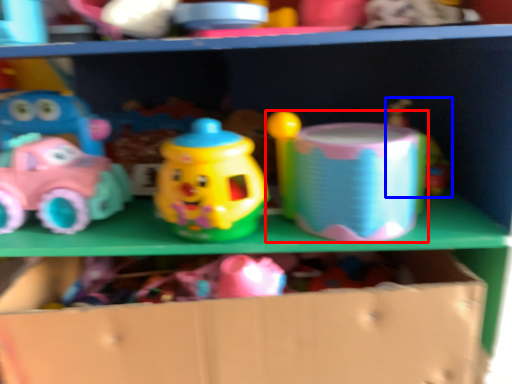
Question: Which object appears farthest to the camera in this image, toy (highlighted by a red box) or toy (highlighted by a blue box)?

Choices:
 (A) toy
 (B) toy

Answer: (B)